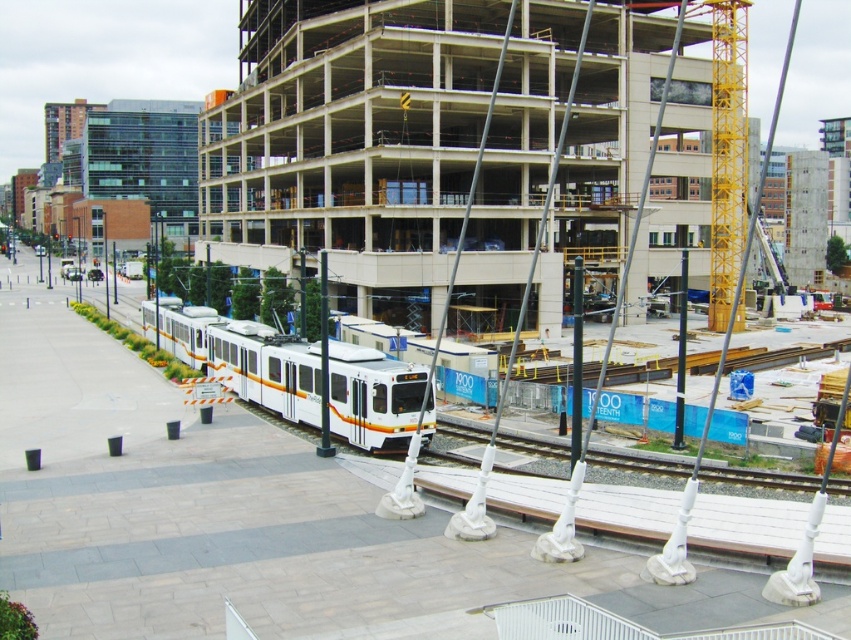
Question: Based on their relative distances, which object is farther from the white concrete building at center?

Choices:
 (A) gray metallic train track at center
 (B) white glossy passenger train at center

Answer: (A)

Question: Is white concrete building at center further to camera compared to gray metallic train track at center?

Choices:
 (A) no
 (B) yes

Answer: (A)

Question: Is white glossy passenger train at center below gray metallic train track at center?

Choices:
 (A) no
 (B) yes

Answer: (A)

Question: Among these points, which one is farthest from the camera?

Choices:
 (A) (189, 308)
 (B) (32, 376)
 (C) (590, 445)

Answer: (A)

Question: Which point is closer to the camera?

Choices:
 (A) gray metallic train track at center
 (B) white concrete building at center
 (C) white glossy passenger train at center

Answer: (B)

Question: Is white concrete building at center above gray metallic train track at center?

Choices:
 (A) yes
 (B) no

Answer: (A)